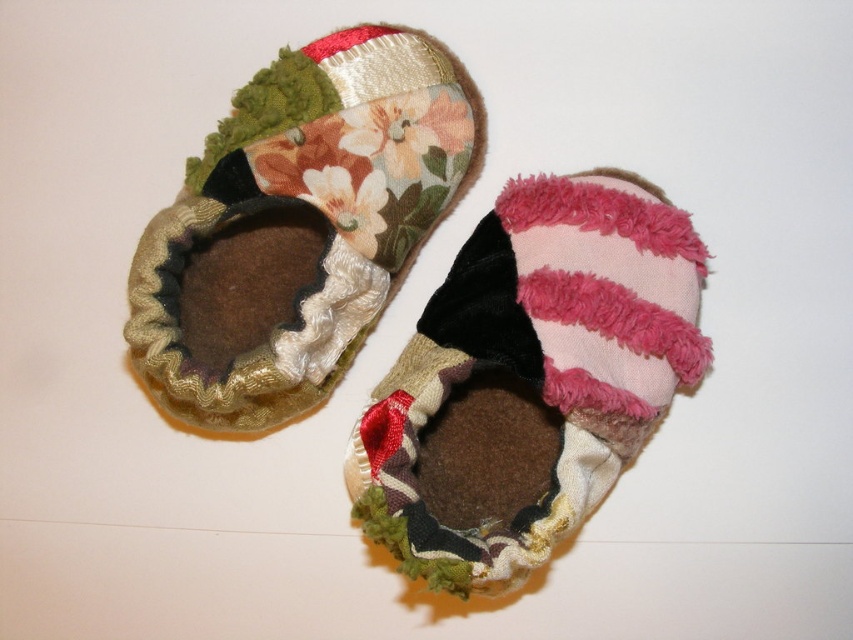
Which is in front, point (421, 435) or point (270, 401)?

Positioned in front is point (421, 435).

Is pink fuzzy slipper at center taller than floral fabric bootie at center?

No.

At what (x,y) coordinates should I click in order to perform the action: click on pink fuzzy slipper at center. Please return your answer as a coordinate pair (x, y). The image size is (853, 640). Looking at the image, I should click on (529, 380).